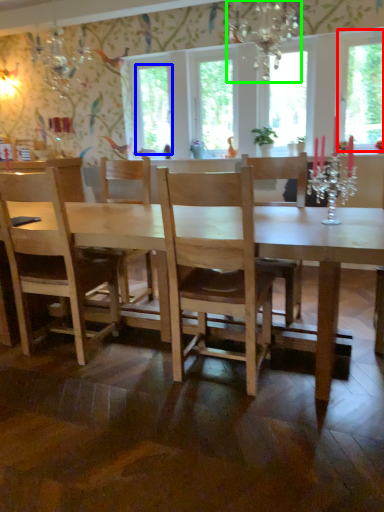
Question: Which is nearer to the window screen (highlighted by a red box)? window screen (highlighted by a blue box) or light fixture (highlighted by a green box).

Choices:
 (A) window screen
 (B) light fixture

Answer: (B)